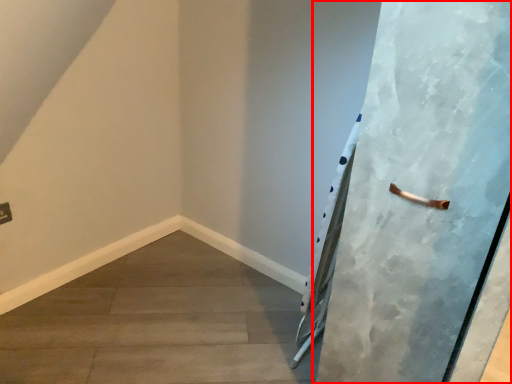
Question: Considering the relative positions of door (annotated by the red box) and concrete in the image provided, where is door (annotated by the red box) located with respect to the staircase?

Choices:
 (A) right
 (B) left

Answer: (A)